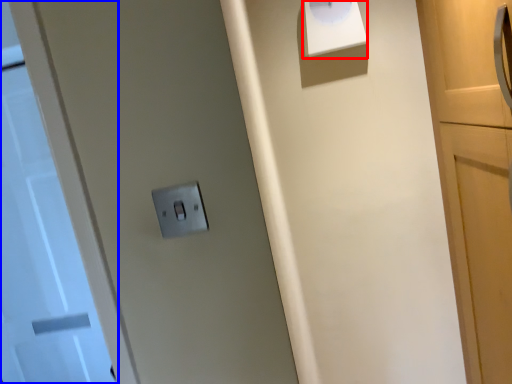
Question: Which object appears farthest to the camera in this image, wide (highlighted by a red box) or door (highlighted by a blue box)?

Choices:
 (A) wide
 (B) door

Answer: (B)